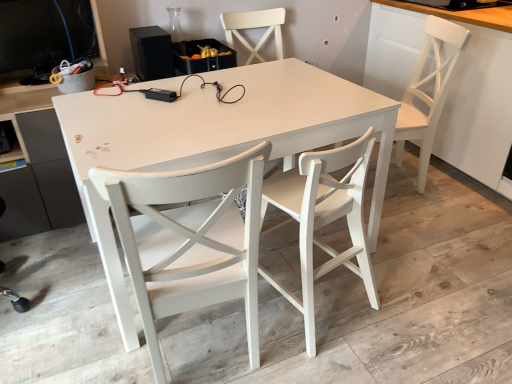
This screenshot has height=384, width=512. Find the location of `vacant space in front of white wood chair at center, the 2th chair from the left`. vacant space in front of white wood chair at center, the 2th chair from the left is located at coordinates (336, 355).